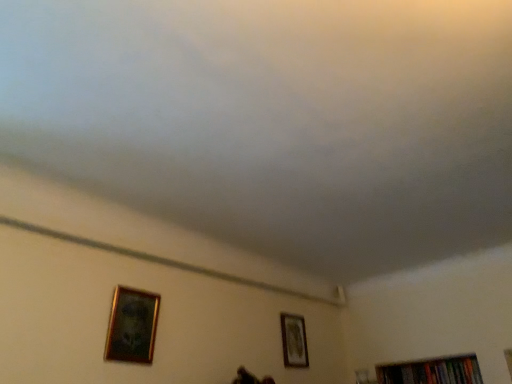
What do you see at coordinates (132, 326) in the screenshot? I see `gold-framed picture at lower left, which is the 1th picture frame from front to back` at bounding box center [132, 326].

Locate an element on the screen. This screenshot has height=384, width=512. hardcover books at bottom right is located at coordinates (432, 371).

Considering the sizes of objects hardcover books at bottom right and gold-framed picture at lower left, which ranks as the second picture frame in bottom-to-top order, in the image provided, who is thinner, hardcover books at bottom right or gold-framed picture at lower left, which ranks as the second picture frame in bottom-to-top order,?

With smaller width is gold-framed picture at lower left, which ranks as the second picture frame in bottom-to-top order.

From the image's perspective, is hardcover books at bottom right below gold-framed picture at lower left, which appears as the second picture frame when viewed from the right?

Yes, from the image's perspective, hardcover books at bottom right is beneath gold-framed picture at lower left, which appears as the second picture frame when viewed from the right.

Considering the positions of point (451, 372) and point (113, 327), is point (451, 372) closer or farther from the camera than point (113, 327)?

Point (451, 372) is positioned farther from the camera compared to point (113, 327).

Is gold-framed picture at lower right, positioned as the 1th picture frame in right-to-left order, aimed at hardcover books at bottom right?

No, gold-framed picture at lower right, positioned as the 1th picture frame in right-to-left order, is not facing towards hardcover books at bottom right.

From a real-world perspective, is gold-framed picture at lower right, which is counted as the second picture frame, starting from the left, above or below hardcover books at bottom right?

gold-framed picture at lower right, which is counted as the second picture frame, starting from the left, is situated higher than hardcover books at bottom right in the real world.

Between gold-framed picture at lower right, acting as the 1th picture frame starting from the bottom, and hardcover books at bottom right, which one has smaller width?

Thinner between the two is gold-framed picture at lower right, acting as the 1th picture frame starting from the bottom.

Is gold-framed picture at lower right, the first picture frame positioned from the back, completely or partially outside of hardcover books at bottom right?

Indeed, gold-framed picture at lower right, the first picture frame positioned from the back, is completely outside hardcover books at bottom right.

Can you confirm if hardcover books at bottom right is taller than gold-framed picture at lower right, positioned as the 1th picture frame in right-to-left order?

No, hardcover books at bottom right is not taller than gold-framed picture at lower right, positioned as the 1th picture frame in right-to-left order.

Can you confirm if hardcover books at bottom right is bigger than gold-framed picture at lower right, acting as the 1th picture frame starting from the bottom?

Yes.

Are gold-framed picture at lower left, which is counted as the 1th picture frame, starting from the top, and hardcover books at bottom right located far from each other?

Yes, gold-framed picture at lower left, which is counted as the 1th picture frame, starting from the top, is far from hardcover books at bottom right.

From a real-world perspective, which object stands above the other?

gold-framed picture at lower left, which ranks as the second picture frame in bottom-to-top order.

Who is bigger, gold-framed picture at lower left, which appears as the second picture frame when viewed from the right, or hardcover books at bottom right?

hardcover books at bottom right is bigger.

Can you tell me how much gold-framed picture at lower left, which is counted as the 1th picture frame, starting from the top, and hardcover books at bottom right differ in facing direction?

The angle between the facing direction of gold-framed picture at lower left, which is counted as the 1th picture frame, starting from the top, and the facing direction of hardcover books at bottom right is 92.8 degrees.

Considering the relative sizes of gold-framed picture at lower right, which is the second picture frame in front-to-back order, and gold-framed picture at lower left, which appears as the second picture frame when viewed from the right, in the image provided, is gold-framed picture at lower right, which is the second picture frame in front-to-back order, thinner than gold-framed picture at lower left, which appears as the second picture frame when viewed from the right,?

Yes.

Considering the sizes of objects gold-framed picture at lower right, the first picture frame positioned from the back, and gold-framed picture at lower left, arranged as the first picture frame when viewed from the left, in the image provided, who is taller, gold-framed picture at lower right, the first picture frame positioned from the back, or gold-framed picture at lower left, arranged as the first picture frame when viewed from the left,?

gold-framed picture at lower right, the first picture frame positioned from the back.

From the image's perspective, which one is positioned lower, gold-framed picture at lower right, which is the second picture frame in front-to-back order, or gold-framed picture at lower left, which ranks as the second picture frame in bottom-to-top order?

gold-framed picture at lower right, which is the second picture frame in front-to-back order, from the image's perspective.

Consider the image. From a real-world perspective, does gold-framed picture at lower right, the first picture frame positioned from the back, sit lower than gold-framed picture at lower left, arranged as the first picture frame when viewed from the left?

No.

Measure the distance from gold-framed picture at lower left, which is counted as the 1th picture frame, starting from the top, to gold-framed picture at lower right, which is counted as the second picture frame, starting from the left.

A distance of 38.08 inches exists between gold-framed picture at lower left, which is counted as the 1th picture frame, starting from the top, and gold-framed picture at lower right, which is counted as the second picture frame, starting from the left.

Considering the points (120, 302) and (286, 352), which point is behind, point (120, 302) or point (286, 352)?

The point (286, 352) is behind.

From a real-world perspective, which object rests below the other?

gold-framed picture at lower left, which is counted as the 1th picture frame, starting from the top, from a real-world perspective.

Considering the sizes of objects gold-framed picture at lower left, which appears as the second picture frame when viewed from the right, and gold-framed picture at lower right, which is the 2th picture frame in top-to-bottom order, in the image provided, who is wider, gold-framed picture at lower left, which appears as the second picture frame when viewed from the right, or gold-framed picture at lower right, which is the 2th picture frame in top-to-bottom order,?

With larger width is gold-framed picture at lower left, which appears as the second picture frame when viewed from the right.

Find the location of a particular element. The width and height of the screenshot is (512, 384). book beneath the gold-framed picture at lower left, which is the 1th picture frame from front to back (from a real-world perspective) is located at coordinates (432, 371).

Image resolution: width=512 pixels, height=384 pixels. In order to click on the 1st picture frame counting from the left of the hardcover books at bottom right in this screenshot , I will do `click(294, 341)`.

Which object lies further to the anchor point hardcover books at bottom right, gold-framed picture at lower left, which is the 1th picture frame from front to back, or gold-framed picture at lower right, which is the 2th picture frame in top-to-bottom order?

gold-framed picture at lower left, which is the 1th picture frame from front to back, is positioned further to the anchor hardcover books at bottom right.

Based on their spatial positions, is gold-framed picture at lower right, which is counted as the second picture frame, starting from the left, or hardcover books at bottom right further from gold-framed picture at lower left, which is counted as the 1th picture frame, starting from the top?

hardcover books at bottom right is positioned further to the anchor gold-framed picture at lower left, which is counted as the 1th picture frame, starting from the top.

Consider the image. From the image, which object appears to be farther from gold-framed picture at lower right, which is the 2th picture frame in top-to-bottom order, gold-framed picture at lower left, which is counted as the 1th picture frame, starting from the top, or hardcover books at bottom right?

gold-framed picture at lower left, which is counted as the 1th picture frame, starting from the top, is positioned further to the anchor gold-framed picture at lower right, which is the 2th picture frame in top-to-bottom order.

When comparing their distances from hardcover books at bottom right, does gold-framed picture at lower right, which is the second picture frame in front-to-back order, or gold-framed picture at lower left, which is counted as the second picture frame, starting from the back, seem closer?

Among the two, gold-framed picture at lower right, which is the second picture frame in front-to-back order, is located nearer to hardcover books at bottom right.

When comparing their distances from gold-framed picture at lower left, which is counted as the 1th picture frame, starting from the top, does hardcover books at bottom right or gold-framed picture at lower right, positioned as the 1th picture frame in right-to-left order, seem further?

hardcover books at bottom right is positioned further to the anchor gold-framed picture at lower left, which is counted as the 1th picture frame, starting from the top.

Estimate the real-world distances between objects in this image. Which object is closer to gold-framed picture at lower right, which is the second picture frame in front-to-back order, hardcover books at bottom right or gold-framed picture at lower left, arranged as the first picture frame when viewed from the left?

hardcover books at bottom right is closer to gold-framed picture at lower right, which is the second picture frame in front-to-back order.

I want to click on picture frame between gold-framed picture at lower left, which is the 1th picture frame from front to back, and hardcover books at bottom right, in the horizontal direction, so click(294, 341).